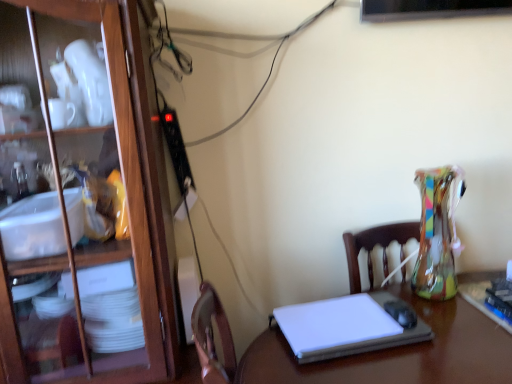
Question: Does wooden cabinet at left have a greater width compared to white glossy desk at center?

Choices:
 (A) yes
 (B) no

Answer: (B)

Question: Could you tell me if wooden cabinet at left is turned towards white glossy desk at center?

Choices:
 (A) no
 (B) yes

Answer: (A)

Question: Would you say wooden cabinet at left is a long distance from white glossy desk at center?

Choices:
 (A) no
 (B) yes

Answer: (A)

Question: Is wooden cabinet at left closer to camera compared to white glossy desk at center?

Choices:
 (A) no
 (B) yes

Answer: (A)

Question: Is wooden cabinet at left looking in the opposite direction of white glossy desk at center?

Choices:
 (A) no
 (B) yes

Answer: (A)

Question: Is wooden cabinet at left bigger than white glossy desk at center?

Choices:
 (A) no
 (B) yes

Answer: (B)

Question: From a real-world perspective, is white glossy desk at center below white matte laptop at center?

Choices:
 (A) yes
 (B) no

Answer: (A)

Question: Considering the relative positions of white glossy desk at center and white matte laptop at center in the image provided, is white glossy desk at center to the left of white matte laptop at center from the viewer's perspective?

Choices:
 (A) yes
 (B) no

Answer: (A)

Question: Is white glossy desk at center surrounding white matte laptop at center?

Choices:
 (A) no
 (B) yes

Answer: (B)

Question: Are white glossy desk at center and white matte laptop at center beside each other?

Choices:
 (A) yes
 (B) no

Answer: (A)

Question: Is white glossy desk at center not close to white matte laptop at center?

Choices:
 (A) no
 (B) yes

Answer: (A)

Question: Is white glossy desk at center thinner than white matte laptop at center?

Choices:
 (A) yes
 (B) no

Answer: (B)

Question: Is white matte laptop at center facing away from white glossy desk at center?

Choices:
 (A) no
 (B) yes

Answer: (B)